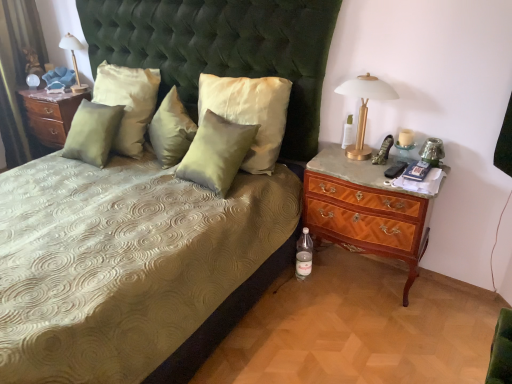
Question: Considering the positions of point (360, 132) and point (117, 120), is point (360, 132) closer or farther from the camera than point (117, 120)?

Choices:
 (A) closer
 (B) farther

Answer: (A)

Question: From a real-world perspective, is gold metallic table lamp at upper right, the first bedside lamp from the front, physically located above or below satin green pillow at center, positioned as the 1th pillow in left-to-right order?

Choices:
 (A) above
 (B) below

Answer: (A)

Question: Estimate the real-world distances between objects in this image. Which object is closer to the translucent glass candle holder at right?

Choices:
 (A) gold metallic table lamp at upper right, the first bedside lamp from the front
 (B) satin green pillow at center, arranged as the second pillow when viewed from the right
 (C) matte gold lamp at upper left, the second bedside lamp when ordered from right to left
 (D) clear glass bottle at right, which is counted as the second bottle, starting from the left
 (E) green velvet curtain at left

Answer: (A)

Question: Based on their relative distances, which object is farther from the gold metallic table lamp at upper right, which appears as the 1th bedside lamp when viewed from the right?

Choices:
 (A) matte gold lamp at upper left, the first bedside lamp viewed from the left
 (B) translucent glass candle holder at right
 (C) satin green pillow at upper left, the fourth pillow positioned from the right
 (D) clear glass bottle at right, which is counted as the second bottle, starting from the left
 (E) satin green pillow at center, positioned as the 1th pillow in left-to-right order

Answer: (A)